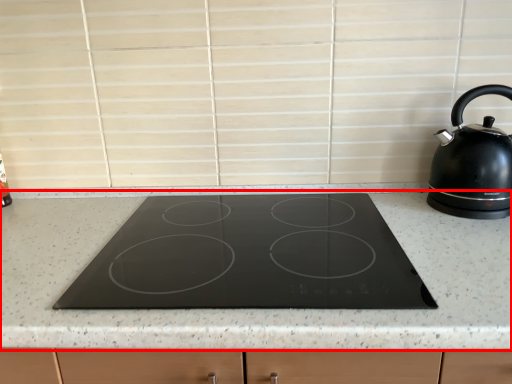
Question: Observing the image, what is the correct spatial positioning of countertop (annotated by the red box) in reference to kettle?

Choices:
 (A) right
 (B) left

Answer: (B)